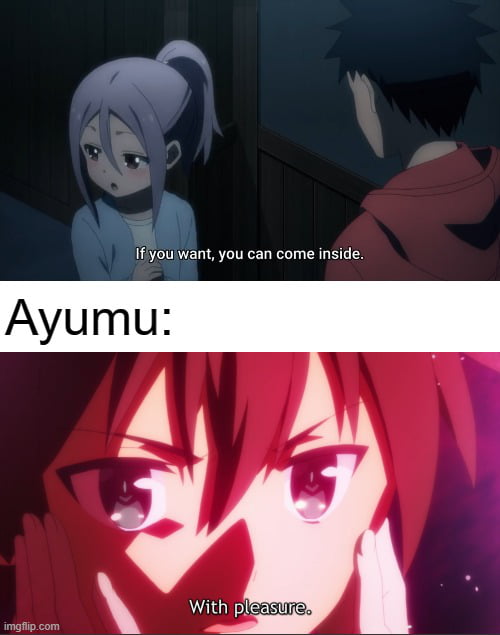
Identify the location of paneling. Image resolution: width=500 pixels, height=635 pixels. (275, 199).